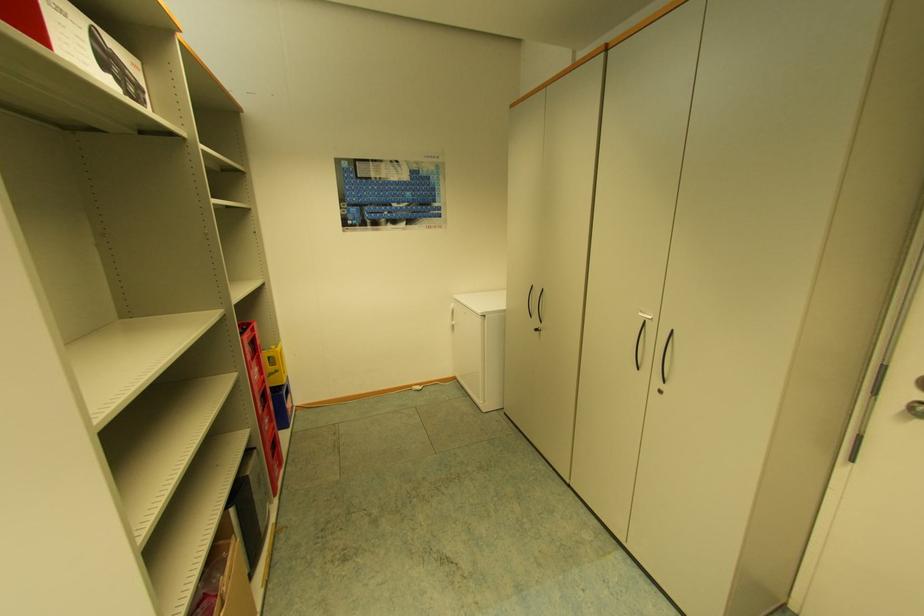
The image size is (924, 616). What are the coordinates of `silver door handle` in the screenshot? It's located at (916, 403).